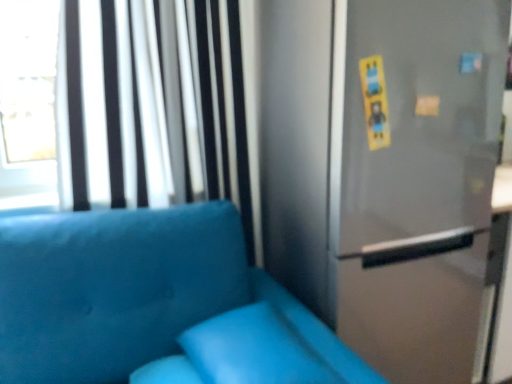
Question: From a real-world perspective, does white/textured curtain at upper left stand above matte blue pillow at lower center?

Choices:
 (A) yes
 (B) no

Answer: (A)

Question: Considering the relative sizes of white/textured curtain at upper left and matte blue pillow at lower center in the image provided, is white/textured curtain at upper left smaller than matte blue pillow at lower center?

Choices:
 (A) yes
 (B) no

Answer: (B)

Question: Considering the relative positions of white/textured curtain at upper left and matte blue pillow at lower center in the image provided, is white/textured curtain at upper left to the left of matte blue pillow at lower center from the viewer's perspective?

Choices:
 (A) yes
 (B) no

Answer: (A)

Question: Is white/textured curtain at upper left wider than matte blue pillow at lower center?

Choices:
 (A) yes
 (B) no

Answer: (B)

Question: From the image's perspective, is white/textured curtain at upper left below matte blue pillow at lower center?

Choices:
 (A) no
 (B) yes

Answer: (A)

Question: From a real-world perspective, relative to white/textured curtain at upper left, is satin silver fridge at right vertically above or below?

Choices:
 (A) below
 (B) above

Answer: (A)

Question: From their relative heights in the image, would you say satin silver fridge at right is taller or shorter than white/textured curtain at upper left?

Choices:
 (A) tall
 (B) short

Answer: (A)

Question: Would you say satin silver fridge at right is to the left or to the right of white/textured curtain at upper left in the picture?

Choices:
 (A) right
 (B) left

Answer: (A)

Question: In terms of size, does satin silver fridge at right appear bigger or smaller than white/textured curtain at upper left?

Choices:
 (A) big
 (B) small

Answer: (A)

Question: Relative to white/textured curtain at upper left, is suede blue couch at lower left in front or behind?

Choices:
 (A) behind
 (B) front

Answer: (B)

Question: Is suede blue couch at lower left to the left or to the right of white/textured curtain at upper left in the image?

Choices:
 (A) right
 (B) left

Answer: (A)

Question: Does point (109, 238) appear closer or farther from the camera than point (179, 134)?

Choices:
 (A) farther
 (B) closer

Answer: (B)

Question: From the image's perspective, relative to white/textured curtain at upper left, is suede blue couch at lower left above or below?

Choices:
 (A) above
 (B) below

Answer: (B)

Question: Based on their sizes in the image, would you say suede blue couch at lower left is bigger or smaller than satin silver screen door at upper right?

Choices:
 (A) big
 (B) small

Answer: (A)

Question: From a real-world perspective, is suede blue couch at lower left physically located above or below satin silver screen door at upper right?

Choices:
 (A) above
 (B) below

Answer: (B)